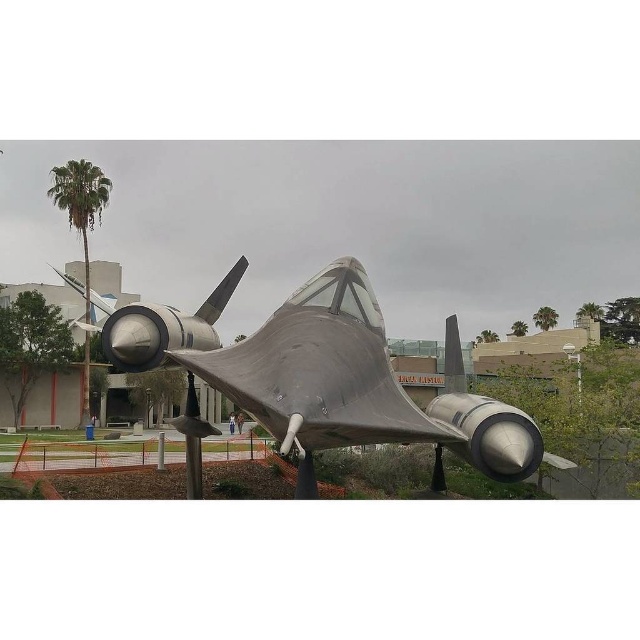
How distant is polished silver aircraft at center from green leafy palm tree at left?

A distance of 86.47 feet exists between polished silver aircraft at center and green leafy palm tree at left.

Does polished silver aircraft at center have a greater width compared to green leafy palm tree at left?

No.

Which is behind, point (109, 358) or point (54, 193)?

Point (54, 193)

Find the location of `polished silver aircraft at center`. polished silver aircraft at center is located at coordinates (321, 378).

At what (x,y) coordinates should I click in order to perform the action: click on green leafy palm tree at left. Please return your answer as a coordinate pair (x, y). The width and height of the screenshot is (640, 640). Looking at the image, I should click on (81, 204).

The height and width of the screenshot is (640, 640). What do you see at coordinates (81, 204) in the screenshot?
I see `green leafy palm tree at left` at bounding box center [81, 204].

Locate an element on the screen. This screenshot has height=640, width=640. green leafy palm tree at left is located at coordinates (81, 204).

Who is more forward, (500, 465) or (554, 314)?

Point (500, 465) is more forward.

Is point (344, 422) behind point (541, 314)?

That is False.

Identify the location of polished silver aircraft at center. (321, 378).

Locate an element on the screen. This screenshot has height=640, width=640. polished silver aircraft at center is located at coordinates (321, 378).